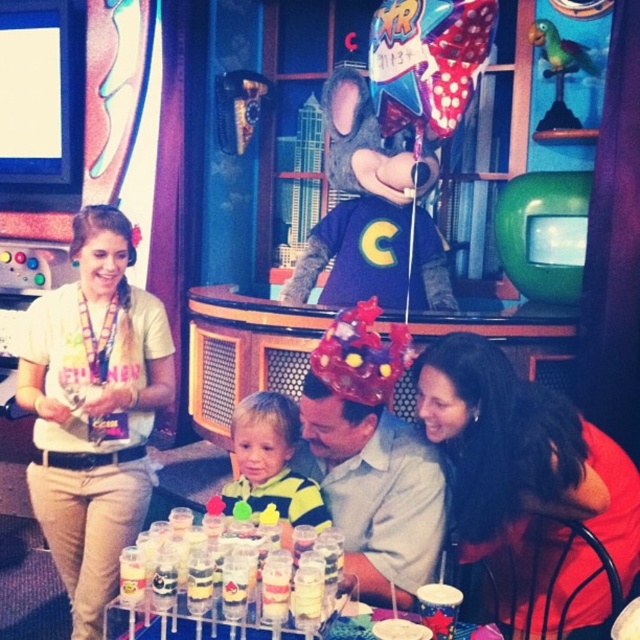
Question: Which is farther from the matte plastic hat at center?

Choices:
 (A) striped fabric shirt at center
 (B) translucent plastic cups at lower center
 (C) green rubber balloon at upper center
 (D) matte red shirt at lower right

Answer: (C)

Question: Which point appears closest to the camera in this image?

Choices:
 (A) (513, 616)
 (B) (262, 481)

Answer: (B)

Question: Does matte plastic hat at center have a smaller size compared to striped fabric shirt at center?

Choices:
 (A) no
 (B) yes

Answer: (A)

Question: Can you confirm if matte red shirt at lower right is thinner than striped fabric shirt at center?

Choices:
 (A) yes
 (B) no

Answer: (B)

Question: Can you confirm if matte plastic hat at center is positioned below green rubber balloon at upper center?

Choices:
 (A) yes
 (B) no

Answer: (A)

Question: Which point is farther to the camera?

Choices:
 (A) green rubber balloon at upper center
 (B) white cotton shirt at left

Answer: (A)